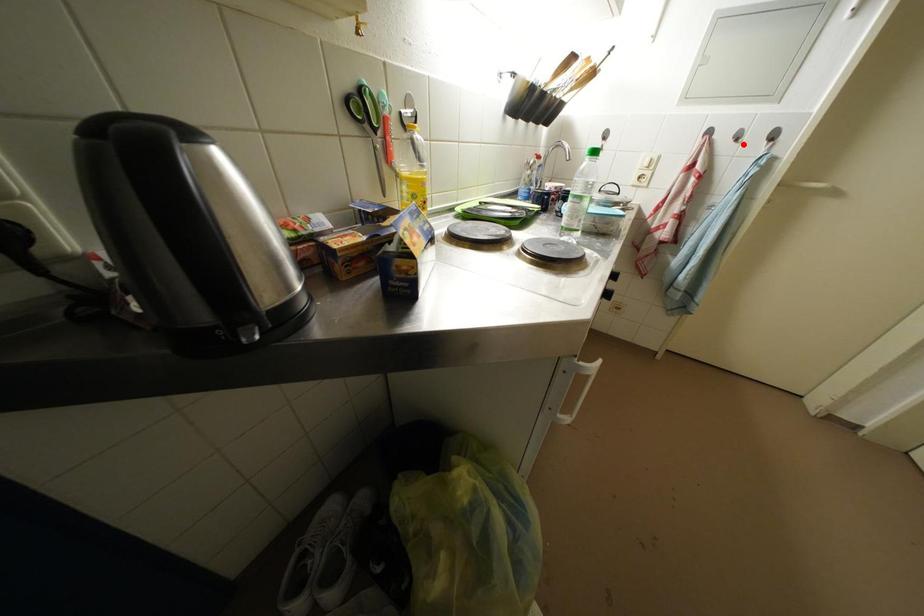
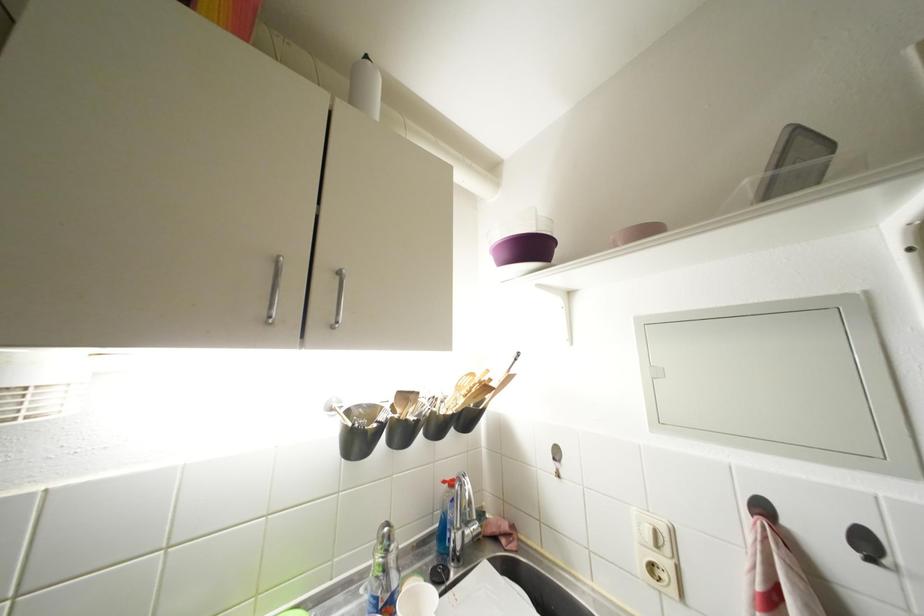
Question: I am providing you with two images of the same scene from different viewpoints. In image1, a red point is highlighted. Considering the same 3D point in image2, which of the following is correct?

Choices:
 (A) It is closer
 (B) It is farther

Answer: (A)